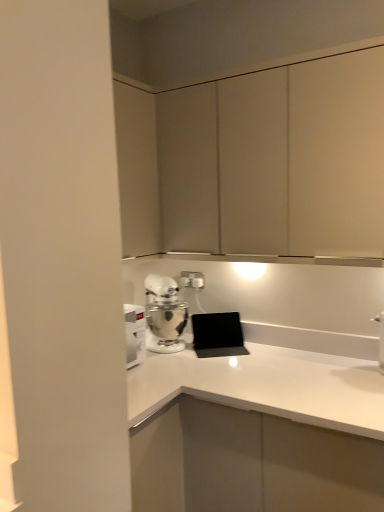
Question: Should I look upward or downward to see matte white cabinet at upper center?

Choices:
 (A) down
 (B) up

Answer: (B)

Question: Is white plastic electric outlet at center further to the viewer compared to matte white cabinet at upper center?

Choices:
 (A) no
 (B) yes

Answer: (B)

Question: Would you say white plastic electric outlet at center is outside matte white cabinet at upper center?

Choices:
 (A) no
 (B) yes

Answer: (B)

Question: Are white plastic electric outlet at center and matte white cabinet at upper center located far from each other?

Choices:
 (A) no
 (B) yes

Answer: (A)

Question: From a real-world perspective, is white plastic electric outlet at center beneath matte white cabinet at upper center?

Choices:
 (A) yes
 (B) no

Answer: (A)

Question: From the image's perspective, would you say white plastic electric outlet at center is positioned over matte white cabinet at upper center?

Choices:
 (A) no
 (B) yes

Answer: (A)

Question: From a real-world perspective, is white plastic electric outlet at center located higher than matte white cabinet at upper center?

Choices:
 (A) yes
 (B) no

Answer: (B)

Question: From the image's perspective, is white metallic stand mixer at lower left on top of matte white cabinet at upper center?

Choices:
 (A) no
 (B) yes

Answer: (A)

Question: Is white metallic stand mixer at lower left closer to the viewer compared to matte white cabinet at upper center?

Choices:
 (A) yes
 (B) no

Answer: (B)

Question: Is white metallic stand mixer at lower left positioned far away from matte white cabinet at upper center?

Choices:
 (A) yes
 (B) no

Answer: (B)

Question: Is white metallic stand mixer at lower left taller than matte white cabinet at upper center?

Choices:
 (A) yes
 (B) no

Answer: (B)

Question: Considering the relative positions of white metallic stand mixer at lower left and matte white cabinet at upper center in the image provided, is white metallic stand mixer at lower left to the right of matte white cabinet at upper center from the viewer's perspective?

Choices:
 (A) no
 (B) yes

Answer: (A)

Question: Does white metallic stand mixer at lower left turn towards matte white cabinet at upper center?

Choices:
 (A) yes
 (B) no

Answer: (B)

Question: Can you confirm if matte white cabinet at upper center is wider than white plastic electric outlet at center?

Choices:
 (A) yes
 (B) no

Answer: (A)